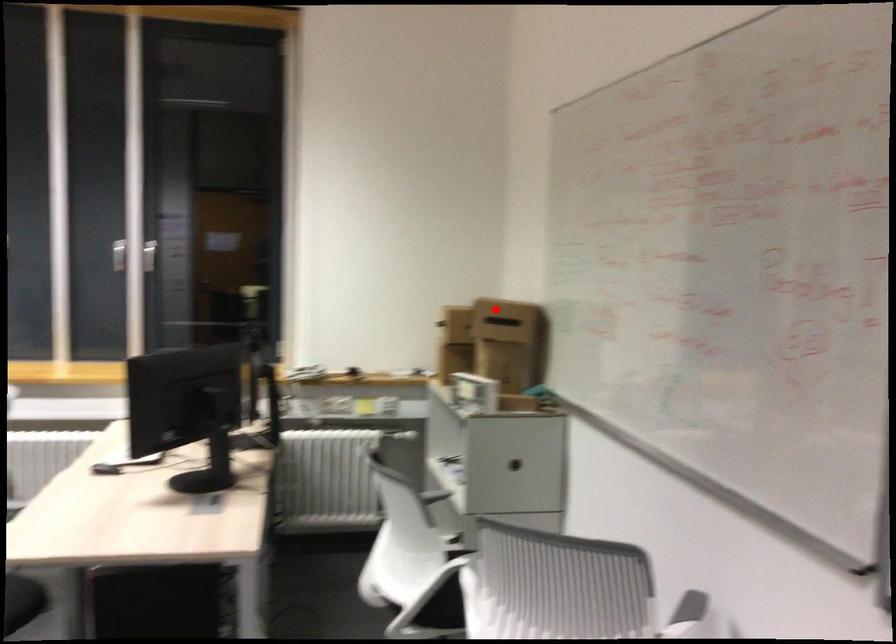
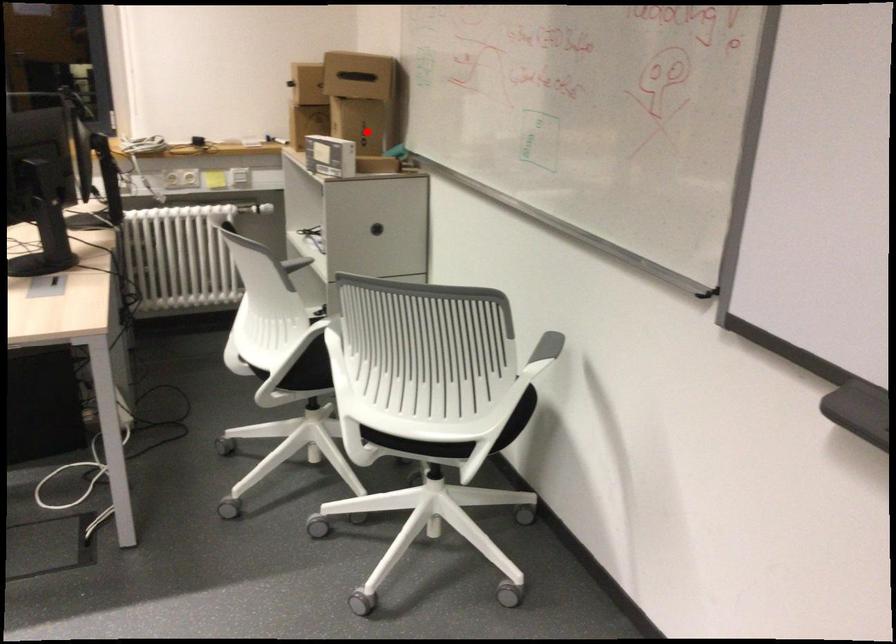
I am providing you with two images of the same scene from different viewpoints. A red point is marked on the first image and another point is marked on the second image. Is the red point in image1 aligned with the point shown in image2?

No